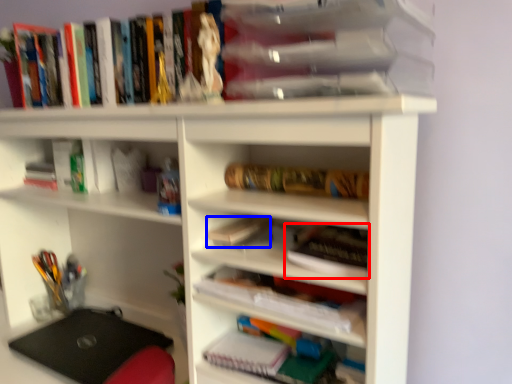
Question: Which of the following is the closest to the observer, book (highlighted by a red box) or book (highlighted by a blue box)?

Choices:
 (A) book
 (B) book

Answer: (A)